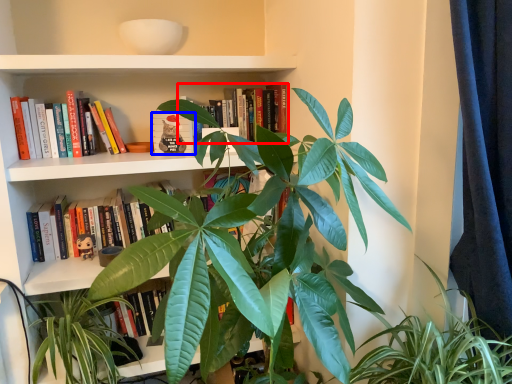
Question: Which object is closer to the camera taking this photo, book (highlighted by a red box) or book (highlighted by a blue box)?

Choices:
 (A) book
 (B) book

Answer: (A)